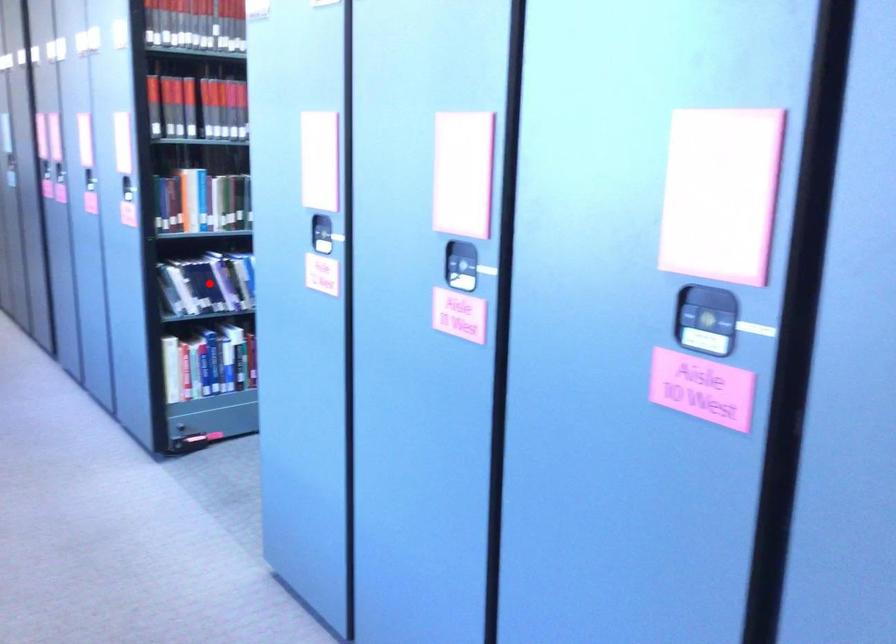
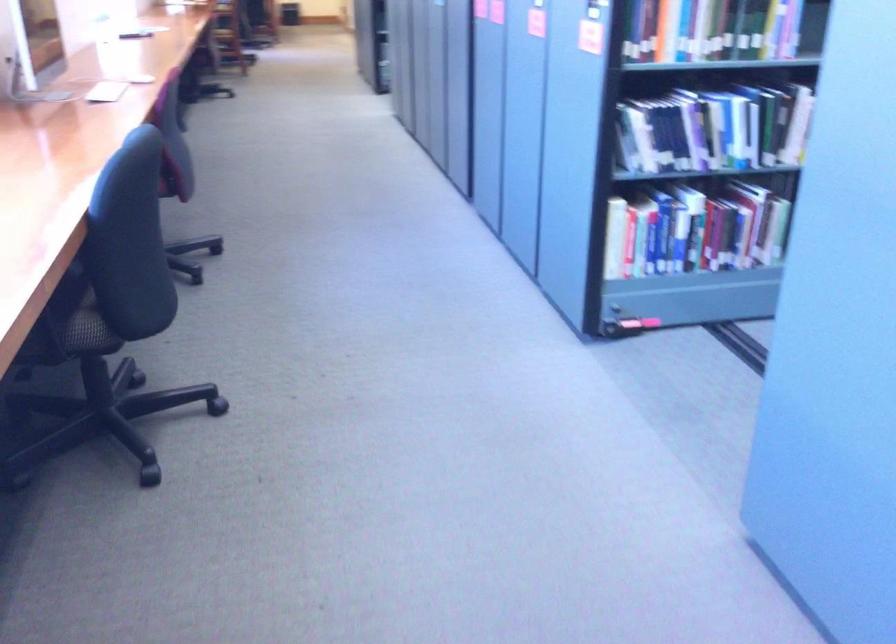
In the second image, find the point that corresponds to the highlighted location in the first image.

(673, 135)